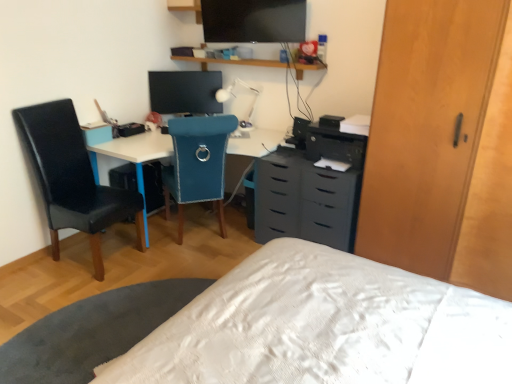
Question: Can you confirm if black leather chair at left, the first chair in the left-to-right sequence, is positioned to the right of white plastic desk at center?

Choices:
 (A) yes
 (B) no

Answer: (B)

Question: Is black leather chair at left, placed as the second chair when sorted from right to left, bigger than white plastic desk at center?

Choices:
 (A) no
 (B) yes

Answer: (A)

Question: Is white plastic desk at center located within black leather chair at left, placed as the second chair when sorted from right to left?

Choices:
 (A) no
 (B) yes

Answer: (A)

Question: Is black leather chair at left, placed as the second chair when sorted from right to left, closer to camera compared to white plastic desk at center?

Choices:
 (A) yes
 (B) no

Answer: (A)

Question: Is black leather chair at left, the first chair in the left-to-right sequence, turned away from white plastic desk at center?

Choices:
 (A) yes
 (B) no

Answer: (B)

Question: Visually, is white plastic table lamp at center positioned to the left or to the right of wooden shelf at upper center?

Choices:
 (A) left
 (B) right

Answer: (A)

Question: Considering the positions of point (x=233, y=100) and point (x=205, y=69), is point (x=233, y=100) closer or farther from the camera than point (x=205, y=69)?

Choices:
 (A) closer
 (B) farther

Answer: (A)

Question: From a real-world perspective, relative to wooden shelf at upper center, is white plastic table lamp at center vertically above or below?

Choices:
 (A) above
 (B) below

Answer: (B)

Question: In terms of height, does white plastic table lamp at center look taller or shorter compared to wooden shelf at upper center?

Choices:
 (A) tall
 (B) short

Answer: (A)

Question: Does point (218, 178) appear closer or farther from the camera than point (176, 59)?

Choices:
 (A) closer
 (B) farther

Answer: (A)

Question: Considering the positions of teal fabric chair at center, arranged as the second chair when viewed from the left, and wooden shelf at upper center in the image, is teal fabric chair at center, arranged as the second chair when viewed from the left, wider or thinner than wooden shelf at upper center?

Choices:
 (A) wide
 (B) thin

Answer: (A)

Question: Looking at the image, does teal fabric chair at center, arranged as the second chair when viewed from the left, seem bigger or smaller compared to wooden shelf at upper center?

Choices:
 (A) big
 (B) small

Answer: (A)

Question: Visually, is teal fabric chair at center, placed as the 1th chair when sorted from right to left, positioned to the left or to the right of wooden shelf at upper center?

Choices:
 (A) left
 (B) right

Answer: (A)

Question: Is light brown wood dresser at right in front of or behind flat matte screen at upper center in the image?

Choices:
 (A) front
 (B) behind

Answer: (A)

Question: Does point (432, 114) appear closer or farther from the camera than point (239, 34)?

Choices:
 (A) farther
 (B) closer

Answer: (B)